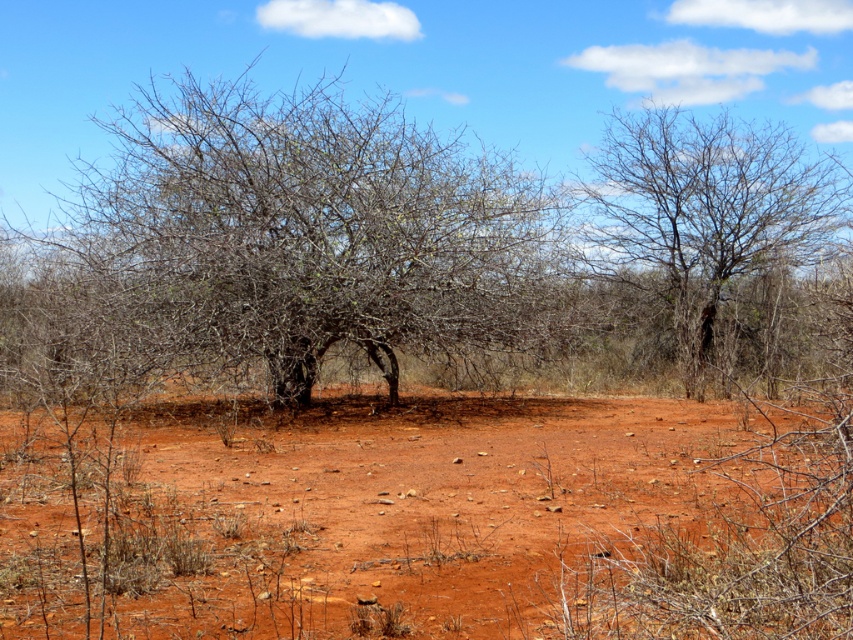
Question: Does dull reddish-brown soil at center have a smaller size compared to bare branches at upper right?

Choices:
 (A) yes
 (B) no

Answer: (A)

Question: Can you confirm if dull reddish-brown soil at center is positioned above bare branches at center?

Choices:
 (A) yes
 (B) no

Answer: (B)

Question: Does dull reddish-brown soil at center have a larger size compared to bare branches at center?

Choices:
 (A) yes
 (B) no

Answer: (B)

Question: Which point is farther to the camera?

Choices:
 (A) (x=422, y=225)
 (B) (x=503, y=460)

Answer: (A)

Question: Among these objects, which one is farthest from the camera?

Choices:
 (A) bare branches at upper right
 (B) bare branches at center
 (C) dull reddish-brown soil at center

Answer: (A)

Question: Which object is closer to the camera taking this photo?

Choices:
 (A) bare branches at upper right
 (B) dull reddish-brown soil at center

Answer: (B)